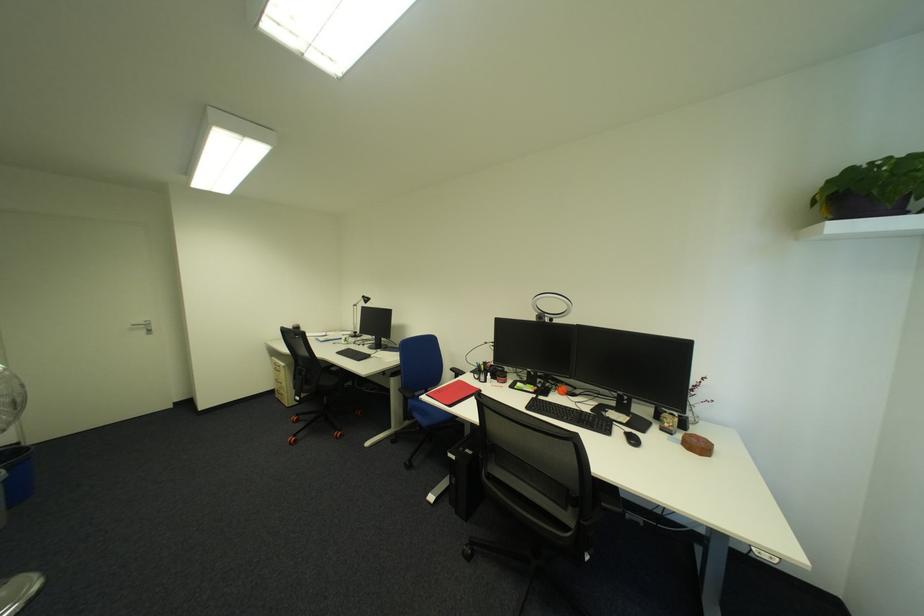
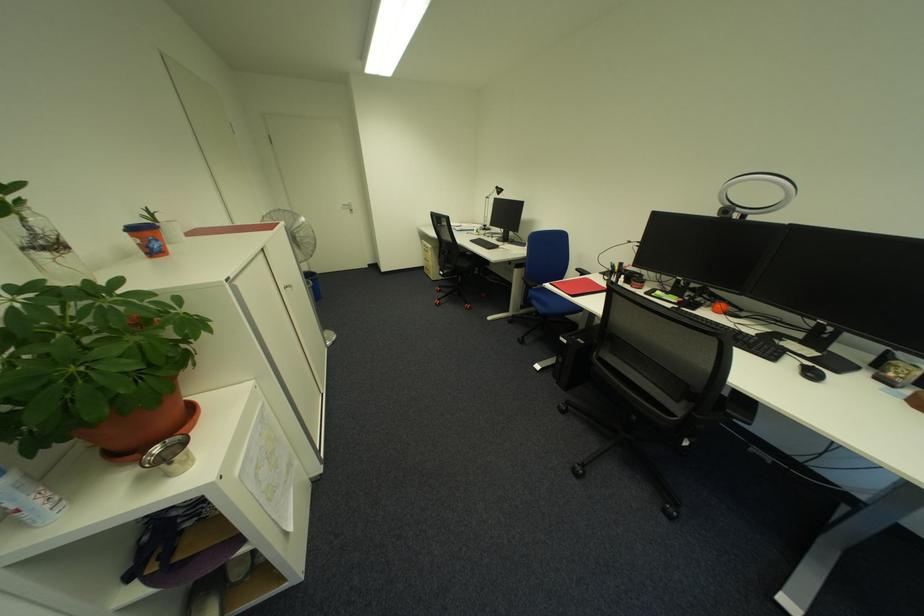
Find the pixel in the second image that matches pixel 565 387 in the first image.

(723, 302)